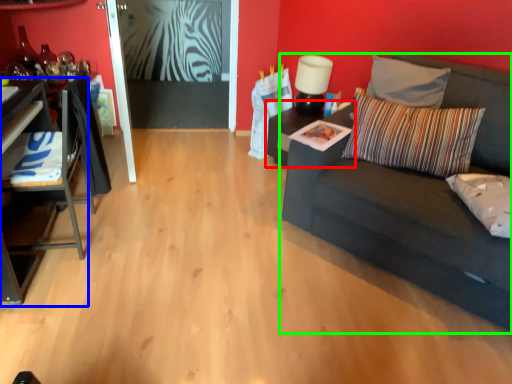
Question: Which object is positioned farthest from table (highlighted by a red box)? Select from table (highlighted by a blue box) and studio couch (highlighted by a green box).

Choices:
 (A) table
 (B) studio couch

Answer: (A)